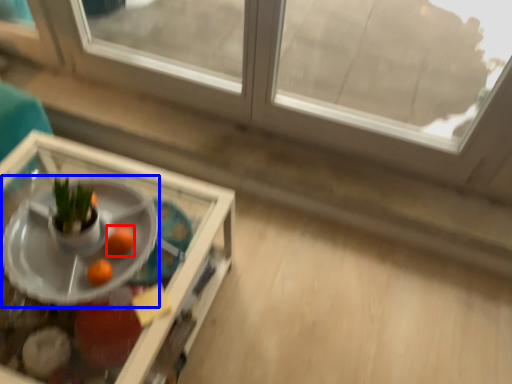
Question: Which object appears closest to the camera in this image, orange (highlighted by a red box) or table (highlighted by a blue box)?

Choices:
 (A) orange
 (B) table

Answer: (B)